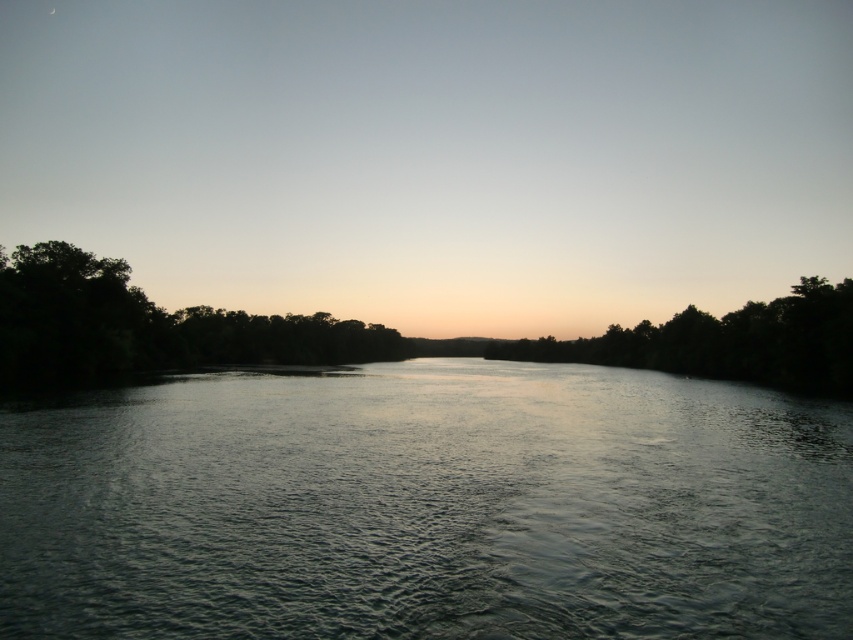
Does point (28, 336) come behind point (704, 364)?

No.

Can you confirm if dark green leafy trees at left is thinner than silhouette leafy tree at center?

Yes, dark green leafy trees at left is thinner than silhouette leafy tree at center.

Locate an element on the screen. The image size is (853, 640). dark green leafy trees at left is located at coordinates (146, 326).

Which is more to the left, dark gray water at center or silhouette leafy tree at center?

From the viewer's perspective, dark gray water at center appears more on the left side.

Between point (9, 557) and point (519, 353), which one is positioned behind?

The point (519, 353) is behind.

You are a GUI agent. You are given a task and a screenshot of the screen. Output one action in this format:
    pyautogui.click(x=<x>, y=<y>)
    Task: Click on the dark gray water at center
    The width and height of the screenshot is (853, 640).
    Given the screenshot: What is the action you would take?
    pyautogui.click(x=427, y=506)

What do you see at coordinates (427, 506) in the screenshot? This screenshot has width=853, height=640. I see `dark gray water at center` at bounding box center [427, 506].

This screenshot has width=853, height=640. Identify the location of dark gray water at center. (427, 506).

I want to click on dark gray water at center, so click(427, 506).